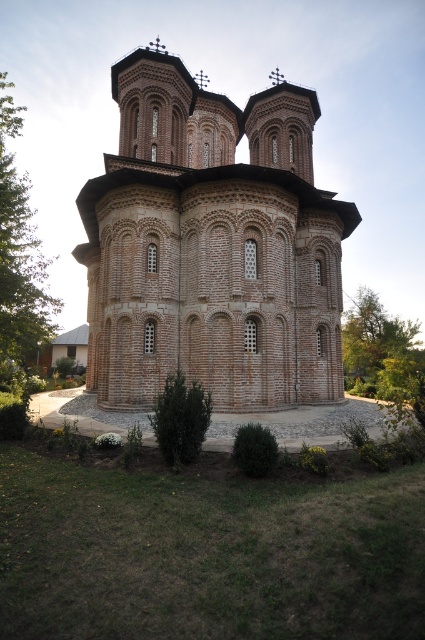
Does brown brick church at center lie in front of green leafy tree at right?

No, it is behind green leafy tree at right.

Is brown brick church at center to the left of green leafy tree at right from the viewer's perspective?

Correct, you'll find brown brick church at center to the left of green leafy tree at right.

Who is more forward, (201, 369) or (357, 320)?

Point (201, 369)

Where is `brown brick church at center`? Image resolution: width=425 pixels, height=640 pixels. brown brick church at center is located at coordinates (212, 246).

Which is in front, point (212, 371) or point (28, 288)?

Point (212, 371)

Is brown brick church at center above green leafy tree at left?

Incorrect, brown brick church at center is not positioned above green leafy tree at left.

Between point (180, 161) and point (19, 371), which one is positioned behind?

The point (19, 371) is behind.

Locate an element on the screen. brown brick church at center is located at coordinates (212, 246).

Which is in front, point (17, 262) or point (359, 312)?

Positioned in front is point (17, 262).

How much distance is there between green leafy tree at left and green leafy tree at right?

29.66 meters

Does point (25, 266) come closer to viewer compared to point (371, 332)?

Yes, point (25, 266) is in front of point (371, 332).

What are the coordinates of `green leafy tree at left` in the screenshot? It's located at pos(19,259).